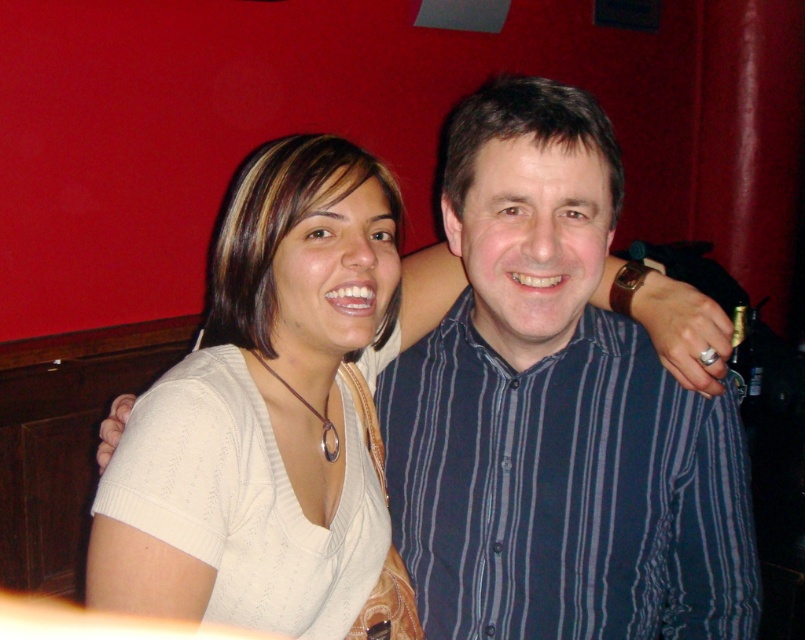
How far apart are white fabric shirt at center and white knitwear at center?

They are 2.76 inches apart.

Is white fabric shirt at center smaller than white knitwear at center?

Actually, white fabric shirt at center might be larger than white knitwear at center.

Find the location of a particular element. This screenshot has width=805, height=640. white fabric shirt at center is located at coordinates [568, 246].

Where is `blue striped shirt at center`? Image resolution: width=805 pixels, height=640 pixels. blue striped shirt at center is located at coordinates (566, 490).

Does blue striped shirt at center have a larger size compared to white knitwear at center?

Actually, blue striped shirt at center might be smaller than white knitwear at center.

I want to click on blue striped shirt at center, so click(x=566, y=490).

Can you confirm if blue striped shirt at center is thinner than white fabric shirt at center?

Yes, blue striped shirt at center is thinner than white fabric shirt at center.

Does blue striped shirt at center appear on the left side of white fabric shirt at center?

No, blue striped shirt at center is not to the left of white fabric shirt at center.

Which is behind, point (618, 566) or point (105, 442)?

The point (105, 442) is behind.

The height and width of the screenshot is (640, 805). In order to click on blue striped shirt at center in this screenshot , I will do `click(566, 490)`.